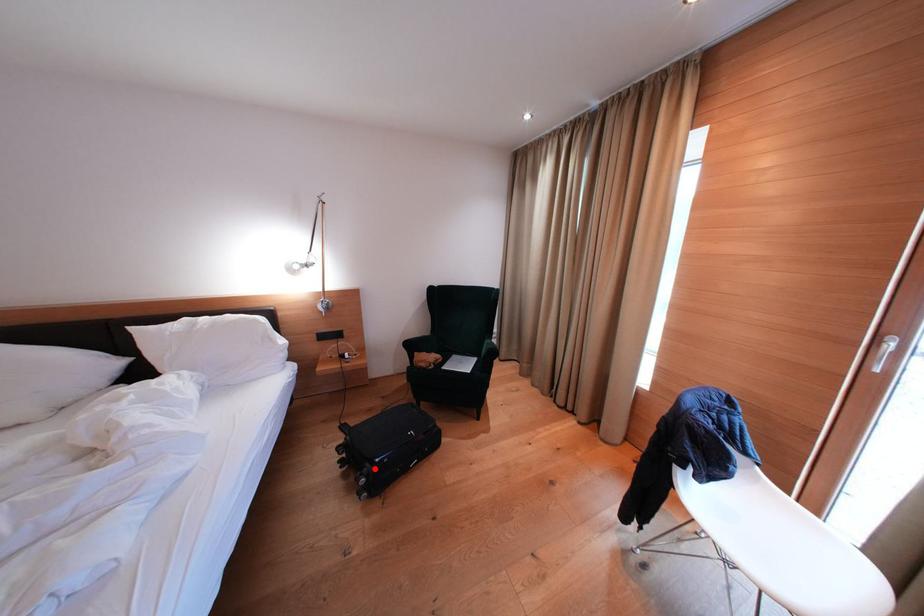
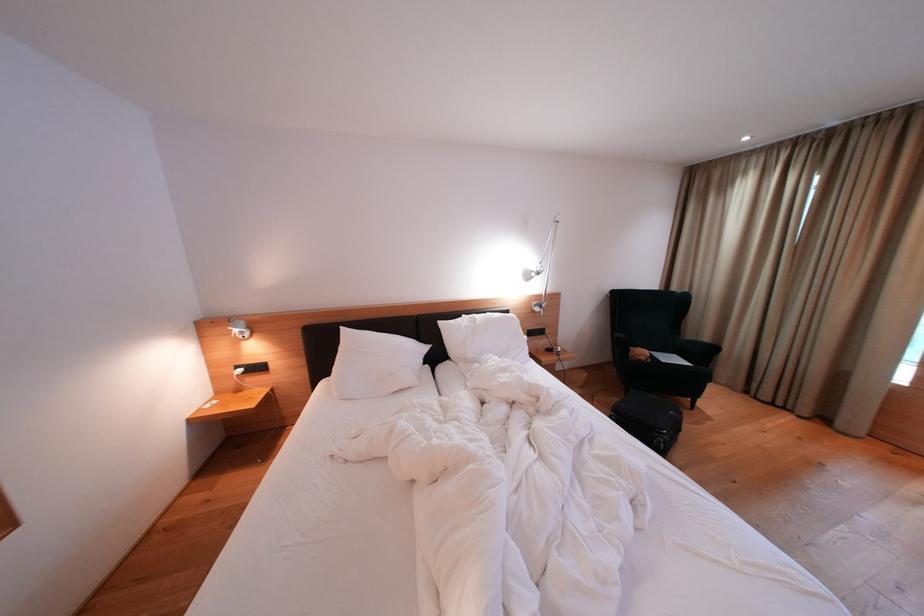
Question: I am providing you with two images of the same scene from different viewpoints. Given a red point in image1, look at the same physical point in image2. Is it:

Choices:
 (A) Closer to the viewpoint
 (B) Farther from the viewpoint

Answer: (B)